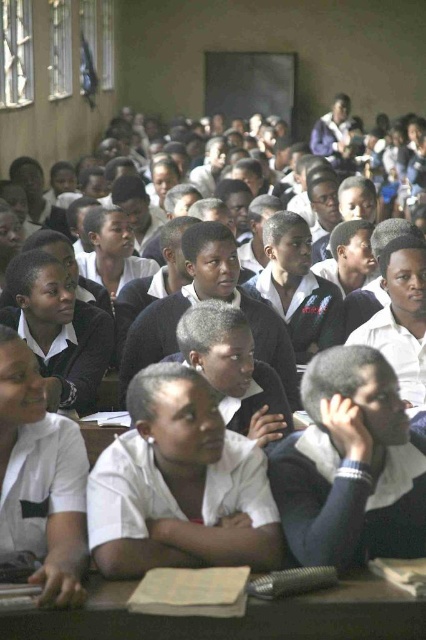
Consider the image. You are a student in the classroom and want to place your notebook on the white matte shirt at center and the wooden desk at center. Which surface has more space to accommodate the notebook?

The wooden desk at center has more space to accommodate the notebook since it is wider than the white matte shirt at center.